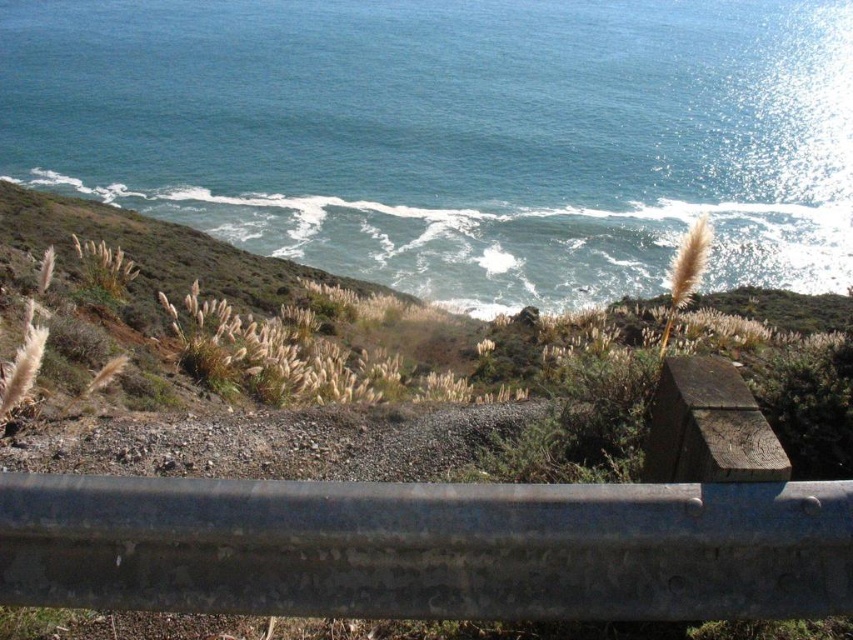
Question: Is blue water at upper center to the left of dry grass at center from the viewer's perspective?

Choices:
 (A) yes
 (B) no

Answer: (A)

Question: Which of the following is the farthest from the observer?

Choices:
 (A) gray metallic rail at center
 (B) dry grass at center

Answer: (B)

Question: Does blue water at upper center have a larger size compared to dry grass at center?

Choices:
 (A) no
 (B) yes

Answer: (B)

Question: Does dry grass at center have a larger size compared to gray metallic rail at center?

Choices:
 (A) no
 (B) yes

Answer: (B)

Question: Which of the following is the farthest from the observer?

Choices:
 (A) (790, 84)
 (B) (520, 460)
 (C) (486, 488)

Answer: (A)

Question: Which object appears closest to the camera in this image?

Choices:
 (A) dry grass at center
 (B) blue water at upper center

Answer: (A)